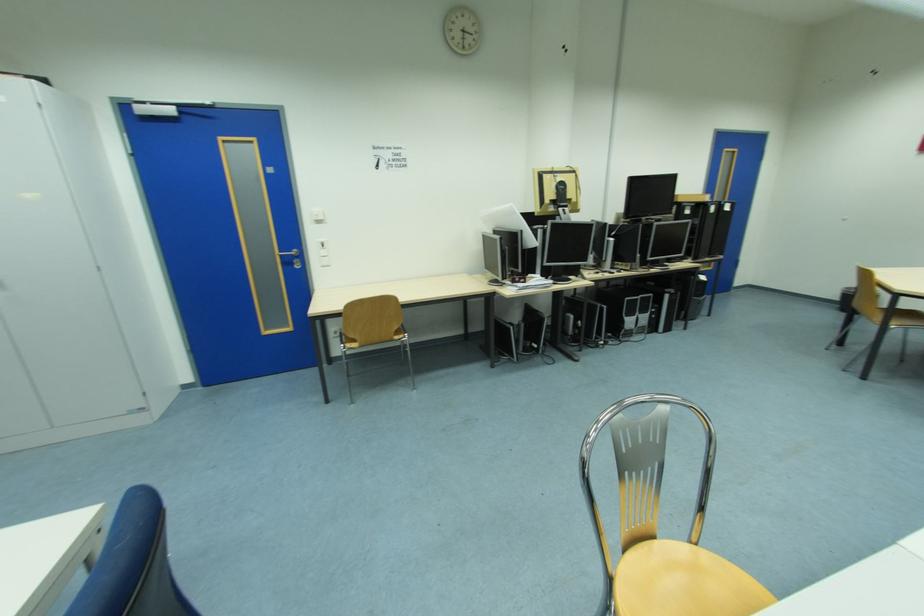
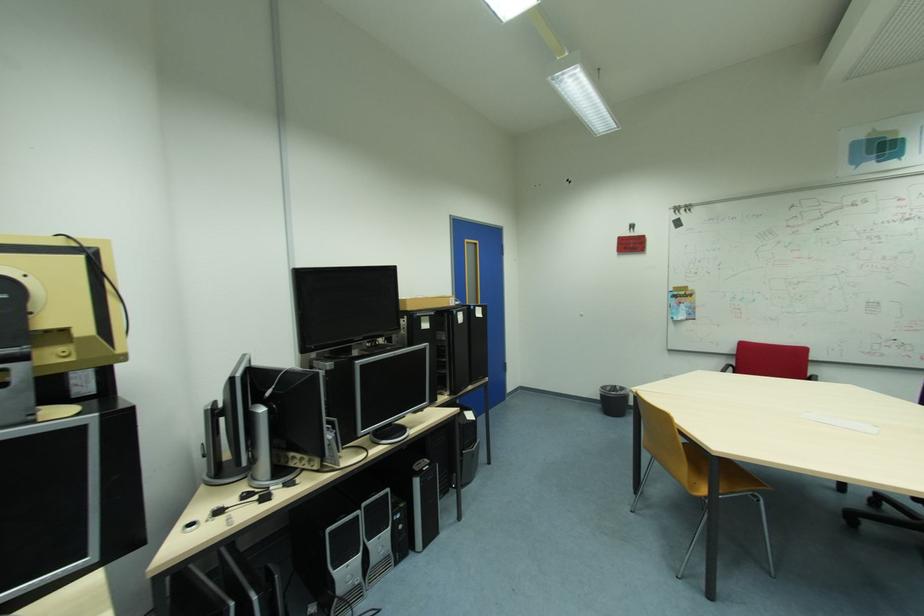
Where in the second image is the point corresponding to point (675, 297) from the first image?

(424, 482)